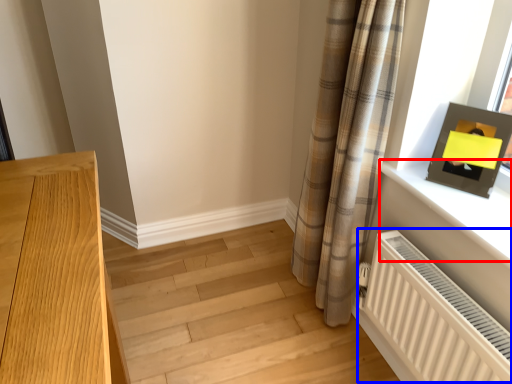
Question: Which point is further to the camera, window sill (highlighted by a red box) or radiator (highlighted by a blue box)?

Choices:
 (A) window sill
 (B) radiator

Answer: (A)